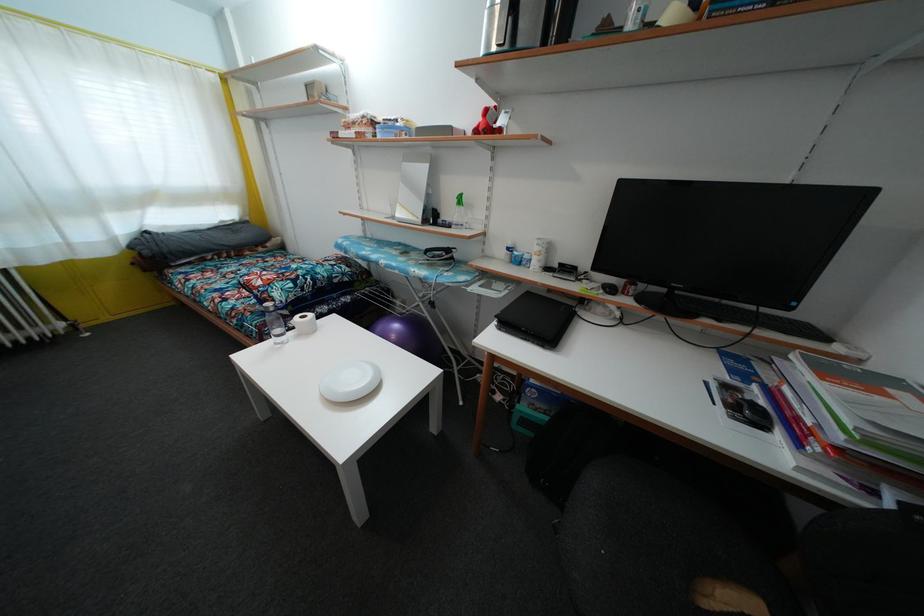
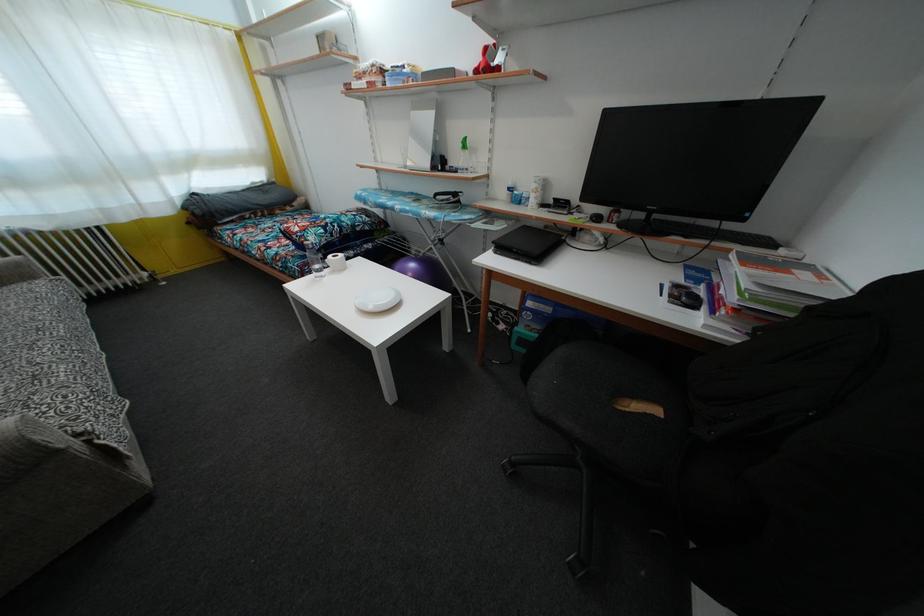
Find the pixel in the second image that matches [314,322] in the first image.

(345, 262)